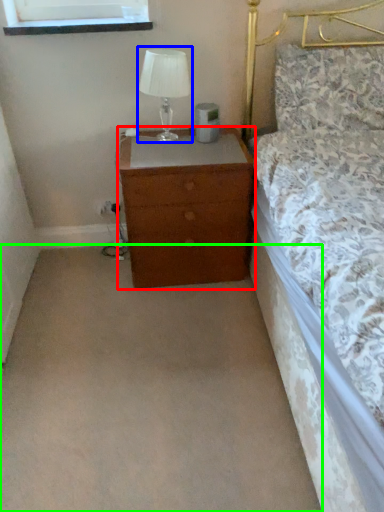
Question: Which object is the closest to the chest of drawers (highlighted by a red box)? Choose among these: table lamp (highlighted by a blue box) or plain (highlighted by a green box).

Choices:
 (A) table lamp
 (B) plain

Answer: (A)